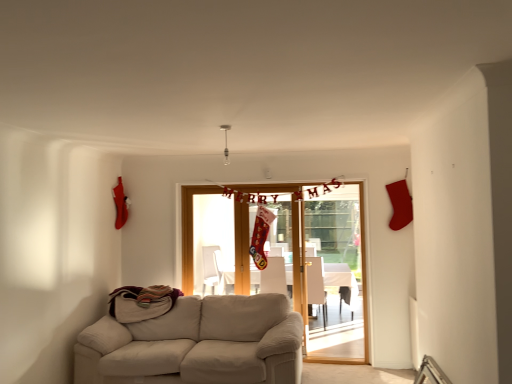
Question: Is matte white armchair at center, which appears as the second armchair when viewed from the left, turned away from white glossy table at center?

Choices:
 (A) no
 (B) yes

Answer: (B)

Question: Is matte white armchair at center, which appears as the second armchair when viewed from the left, not near white glossy table at center?

Choices:
 (A) no
 (B) yes

Answer: (A)

Question: Does matte white armchair at center, which appears as the second armchair when viewed from the left, have a lesser height compared to white glossy table at center?

Choices:
 (A) no
 (B) yes

Answer: (A)

Question: Can you confirm if matte white armchair at center, positioned as the 1th armchair in right-to-left order, is wider than white glossy table at center?

Choices:
 (A) yes
 (B) no

Answer: (B)

Question: Does matte white armchair at center, positioned as the 1th armchair in right-to-left order, have a lesser width compared to white glossy table at center?

Choices:
 (A) yes
 (B) no

Answer: (A)

Question: Is white glossy table at center located within matte white armchair at center, positioned as the 1th armchair in right-to-left order?

Choices:
 (A) no
 (B) yes

Answer: (A)

Question: Is wooden door at center closer to camera compared to beige fabric couch at lower left?

Choices:
 (A) no
 (B) yes

Answer: (A)

Question: Considering the relative sizes of wooden door at center and beige fabric couch at lower left in the image provided, is wooden door at center smaller than beige fabric couch at lower left?

Choices:
 (A) no
 (B) yes

Answer: (B)

Question: From the image's perspective, is wooden door at center below beige fabric couch at lower left?

Choices:
 (A) yes
 (B) no

Answer: (B)

Question: Does wooden door at center have a lesser width compared to beige fabric couch at lower left?

Choices:
 (A) no
 (B) yes

Answer: (B)

Question: Could you tell me if wooden door at center is facing beige fabric couch at lower left?

Choices:
 (A) no
 (B) yes

Answer: (B)

Question: Is beige fabric couch at lower left at the back of wooden door at center?

Choices:
 (A) yes
 (B) no

Answer: (A)

Question: Is beige fabric couch at lower left wider than wooden door at center?

Choices:
 (A) no
 (B) yes

Answer: (B)